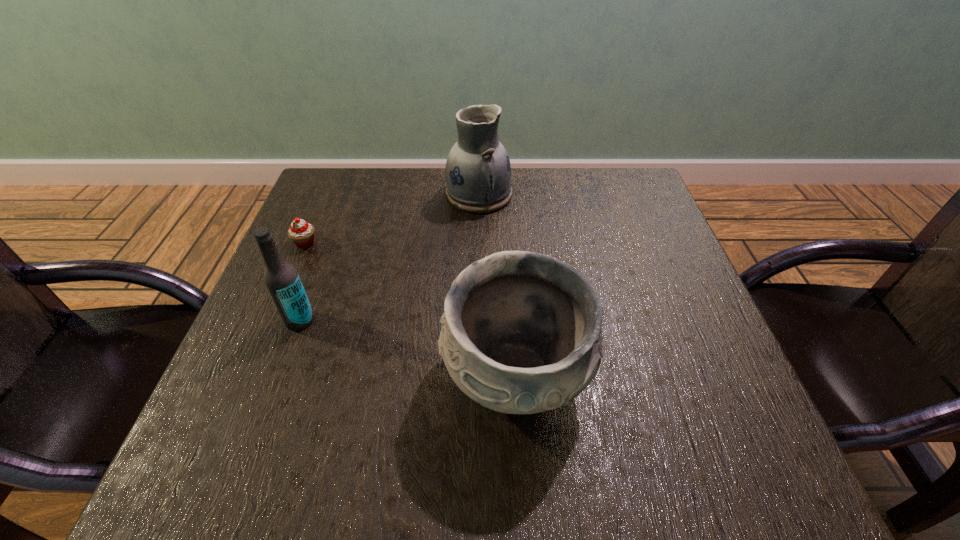
Where is `free spot located 0.120m on the right of the third nearest object`? Image resolution: width=960 pixels, height=540 pixels. free spot located 0.120m on the right of the third nearest object is located at coordinates (369, 244).

Locate an element on the screen. object that is positioned at the far edge is located at coordinates (478, 173).

The width and height of the screenshot is (960, 540). Find the location of `object situated at the near edge`. object situated at the near edge is located at coordinates (521, 333).

Find the location of a particular element. beer bottle located in the left edge section of the desktop is located at coordinates (282, 280).

Find the location of `cupcake present at the left edge`. cupcake present at the left edge is located at coordinates (302, 233).

Locate an element on the screen. This screenshot has height=540, width=960. vacant region at the far edge is located at coordinates (411, 184).

In the image, there is a desktop. In order to click on blank space at the near edge in this screenshot , I will do `click(615, 470)`.

Image resolution: width=960 pixels, height=540 pixels. I want to click on free space at the left edge, so click(321, 321).

At what (x,y) coordinates should I click in order to perform the action: click on free spot at the right edge of the desktop. Please return your answer as a coordinate pair (x, y). The width and height of the screenshot is (960, 540). Looking at the image, I should click on (711, 335).

Identify the location of vacant space at the far left corner of the desktop. The width and height of the screenshot is (960, 540). (331, 172).